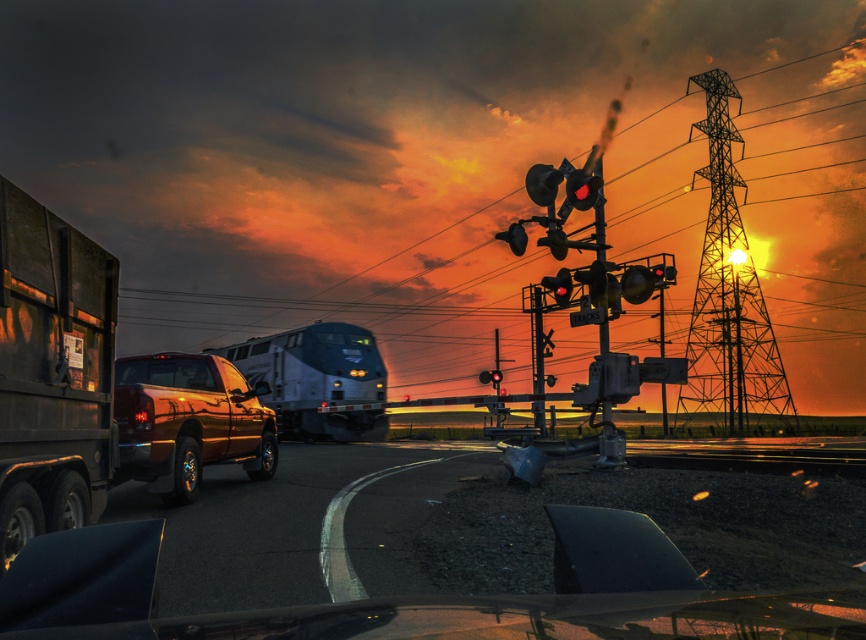
Question: Is matte black traffic light at center positioned before red glass traffic light at center?

Choices:
 (A) no
 (B) yes

Answer: (B)

Question: Is dark matte trailer truck at left above matte black traffic light at center?

Choices:
 (A) no
 (B) yes

Answer: (A)

Question: Does matte black train at center come behind red glass traffic light at center?

Choices:
 (A) yes
 (B) no

Answer: (B)

Question: Which object is the closest to the matte black train at center?

Choices:
 (A) metallic gold truck at lower left
 (B) matte black traffic light at upper right

Answer: (B)

Question: Based on their relative distances, which object is nearer to the dark matte trailer truck at left?

Choices:
 (A) red glass traffic light at center
 (B) metallic gold truck at lower left
 (C) metallic red traffic light at upper right

Answer: (B)

Question: Estimate the real-world distances between objects in this image. Which object is farther from the metallic gold truck at lower left?

Choices:
 (A) matte black traffic light at center
 (B) matte black train at center

Answer: (B)